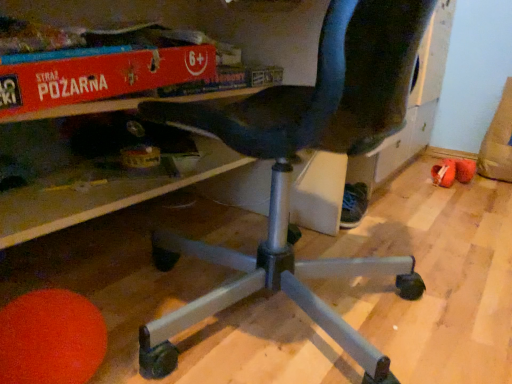
Where is `black fabric shoe at lower center, which is the 2th footwear in right-to-left order`? The image size is (512, 384). black fabric shoe at lower center, which is the 2th footwear in right-to-left order is located at coordinates (353, 205).

Describe the element at coordinates (99, 77) in the screenshot. The width and height of the screenshot is (512, 384). I see `red cardboard box at upper center` at that location.

This screenshot has height=384, width=512. In order to click on orange fabric shoe at lower right, marked as the second footwear in a front-to-back arrangement in this screenshot , I will do `click(444, 173)`.

Describe the element at coordinates (444, 173) in the screenshot. This screenshot has height=384, width=512. I see `orange fabric shoe at lower right, marked as the 1th footwear in a right-to-left arrangement` at that location.

The image size is (512, 384). What do you see at coordinates (498, 141) in the screenshot? I see `brown suede bean bag at lower right` at bounding box center [498, 141].

Locate an element on the screen. The image size is (512, 384). black plastic chair at center is located at coordinates (292, 170).

Looking at this image, between red cardboard box at upper center and brown suede bean bag at lower right, which one has larger size?

brown suede bean bag at lower right.

Would you consider red cardboard box at upper center to be distant from brown suede bean bag at lower right?

red cardboard box at upper center is positioned a significant distance from brown suede bean bag at lower right.

Considering the sizes of objects red cardboard box at upper center and brown suede bean bag at lower right in the image provided, who is taller, red cardboard box at upper center or brown suede bean bag at lower right?

brown suede bean bag at lower right is taller.

Could you tell me if red cardboard box at upper center is facing brown suede bean bag at lower right?

No.

Between black plastic chair at center and black fabric shoe at lower center, the second footwear from the back, which one has larger width?

black plastic chair at center.

Looking at this image, considering the positions of objects black plastic chair at center and black fabric shoe at lower center, the second footwear from the back, in the image provided, who is in front, black plastic chair at center or black fabric shoe at lower center, the second footwear from the back,?

Positioned in front is black plastic chair at center.

Is black plastic chair at center not within black fabric shoe at lower center, the 1th footwear in the left-to-right sequence?

black plastic chair at center lies outside black fabric shoe at lower center, the 1th footwear in the left-to-right sequence,'s area.

From the image's perspective, is black plastic chair at center positioned above or below black fabric shoe at lower center, the second footwear from the back?

From the image's perspective, black plastic chair at center appears above black fabric shoe at lower center, the second footwear from the back.

Is brown suede bean bag at lower right further to the viewer compared to red cardboard box at upper center?

Yes, the depth of brown suede bean bag at lower right is greater than that of red cardboard box at upper center.

Between brown suede bean bag at lower right and red cardboard box at upper center, which one has less height?

Standing shorter between the two is red cardboard box at upper center.

Measure the distance from brown suede bean bag at lower right to red cardboard box at upper center.

5.29 feet.

Visually, is brown suede bean bag at lower right positioned to the left or to the right of red cardboard box at upper center?

From the image, it's evident that brown suede bean bag at lower right is to the right of red cardboard box at upper center.

Is black plastic chair at center facing towards orange fabric shoe at lower right, marked as the second footwear in a front-to-back arrangement?

No, black plastic chair at center is not oriented towards orange fabric shoe at lower right, marked as the second footwear in a front-to-back arrangement.

Which is more to the right, black plastic chair at center or orange fabric shoe at lower right, placed as the second footwear when sorted from left to right?

orange fabric shoe at lower right, placed as the second footwear when sorted from left to right.

Does black plastic chair at center lie behind orange fabric shoe at lower right, which is the first footwear in back-to-front order?

No, it is not.

The image size is (512, 384). What are the coordinates of `chair above the orange fabric shoe at lower right, placed as the second footwear when sorted from left to right (from a real-world perspective)` in the screenshot? It's located at (292, 170).

Can you tell me how much brown suede bean bag at lower right and black plastic chair at center differ in facing direction?

brown suede bean bag at lower right and black plastic chair at center are facing 86.7 degrees away from each other.

Is brown suede bean bag at lower right behind black plastic chair at center?

Yes, the depth of brown suede bean bag at lower right is greater than that of black plastic chair at center.

Consider the image. Considering the sizes of objects brown suede bean bag at lower right and black plastic chair at center in the image provided, who is thinner, brown suede bean bag at lower right or black plastic chair at center?

brown suede bean bag at lower right is thinner.

Considering the sizes of objects brown suede bean bag at lower right and black plastic chair at center in the image provided, who is bigger, brown suede bean bag at lower right or black plastic chair at center?

With larger size is black plastic chair at center.

Choose the correct answer: Is black fabric shoe at lower center, which is the 2th footwear in right-to-left order, inside red cardboard box at upper center or outside it?

black fabric shoe at lower center, which is the 2th footwear in right-to-left order, exists outside the volume of red cardboard box at upper center.

From the image's perspective, which footwear is the 2nd one below the red cardboard box at upper center? Please provide its 2D coordinates.

[(353, 205)]

Based on the photo, is black fabric shoe at lower center, the second footwear from the back, facing towards red cardboard box at upper center?

No, black fabric shoe at lower center, the second footwear from the back, is not facing towards red cardboard box at upper center.

From the image's perspective, is brown suede bean bag at lower right on black fabric shoe at lower center, which is the 2th footwear in right-to-left order?

Yes, from the image's perspective, brown suede bean bag at lower right is on top of black fabric shoe at lower center, which is the 2th footwear in right-to-left order.

Based on the photo, is brown suede bean bag at lower right turned away from black fabric shoe at lower center, the second footwear from the back?

brown suede bean bag at lower right does not have its back to black fabric shoe at lower center, the second footwear from the back.

Which object is thinner, brown suede bean bag at lower right or black fabric shoe at lower center, which is the 2th footwear in right-to-left order?

Thinner between the two is black fabric shoe at lower center, which is the 2th footwear in right-to-left order.

Can you confirm if brown suede bean bag at lower right is positioned to the right of black fabric shoe at lower center, which ranks as the first footwear in front-to-back order?

Correct, you'll find brown suede bean bag at lower right to the right of black fabric shoe at lower center, which ranks as the first footwear in front-to-back order.

You are a GUI agent. You are given a task and a screenshot of the screen. Output one action in this format:
    pyautogui.click(x=<x>, y=<y>)
    Task: Click on the paperback book lying below the brown suede bean bag at lower right (from the image's perspective)
    The width and height of the screenshot is (512, 384).
    Given the screenshot: What is the action you would take?
    pyautogui.click(x=99, y=77)

Locate an element on the screen. the 1st footwear to the right when counting from the black plastic chair at center is located at coordinates (353, 205).

From the image, which object appears to be farther from orange fabric shoe at lower right, marked as the 1th footwear in a right-to-left arrangement, black fabric shoe at lower center, which is the 2th footwear in right-to-left order, or black plastic chair at center?

Based on the image, black plastic chair at center appears to be further to orange fabric shoe at lower right, marked as the 1th footwear in a right-to-left arrangement.

When comparing their distances from brown suede bean bag at lower right, does black plastic chair at center or black fabric shoe at lower center, the second footwear from the back, seem closer?

black fabric shoe at lower center, the second footwear from the back.

Based on their spatial positions, is black fabric shoe at lower center, the 1th footwear in the left-to-right sequence, or black plastic chair at center closer to brown suede bean bag at lower right?

Among the two, black fabric shoe at lower center, the 1th footwear in the left-to-right sequence, is located nearer to brown suede bean bag at lower right.

Which object lies further to the anchor point red cardboard box at upper center, orange fabric shoe at lower right, marked as the second footwear in a front-to-back arrangement, or brown suede bean bag at lower right?

brown suede bean bag at lower right lies further to red cardboard box at upper center than the other object.

Which object lies nearer to the anchor point black fabric shoe at lower center, the second footwear from the back, black plastic chair at center or brown suede bean bag at lower right?

Based on the image, black plastic chair at center appears to be nearer to black fabric shoe at lower center, the second footwear from the back.

Estimate the real-world distances between objects in this image. Which object is closer to orange fabric shoe at lower right, which is the first footwear in back-to-front order, red cardboard box at upper center or brown suede bean bag at lower right?

brown suede bean bag at lower right lies closer to orange fabric shoe at lower right, which is the first footwear in back-to-front order, than the other object.

Which object lies nearer to the anchor point black plastic chair at center, red cardboard box at upper center or black fabric shoe at lower center, the 1th footwear in the left-to-right sequence?

Based on the image, red cardboard box at upper center appears to be nearer to black plastic chair at center.

Estimate the real-world distances between objects in this image. Which object is further from orange fabric shoe at lower right, placed as the second footwear when sorted from left to right, black plastic chair at center or red cardboard box at upper center?

red cardboard box at upper center lies further to orange fabric shoe at lower right, placed as the second footwear when sorted from left to right, than the other object.

Identify the location of footwear positioned between red cardboard box at upper center and orange fabric shoe at lower right, placed as the second footwear when sorted from left to right, from near to far. The height and width of the screenshot is (384, 512). (353, 205).

The width and height of the screenshot is (512, 384). I want to click on bean bag chair positioned between black plastic chair at center and orange fabric shoe at lower right, placed as the second footwear when sorted from left to right, from near to far, so click(x=498, y=141).

This screenshot has width=512, height=384. Find the location of `paperback book positioned between black plastic chair at center and orange fabric shoe at lower right, marked as the second footwear in a front-to-back arrangement, from near to far`. paperback book positioned between black plastic chair at center and orange fabric shoe at lower right, marked as the second footwear in a front-to-back arrangement, from near to far is located at coordinates (99, 77).

Identify the location of footwear located between black plastic chair at center and orange fabric shoe at lower right, marked as the 1th footwear in a right-to-left arrangement, in the depth direction. (353, 205).